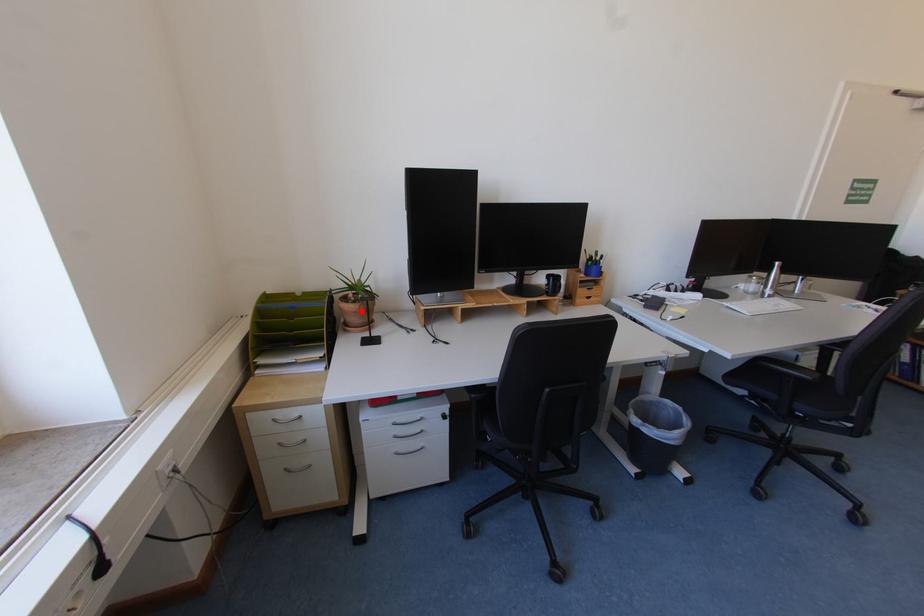
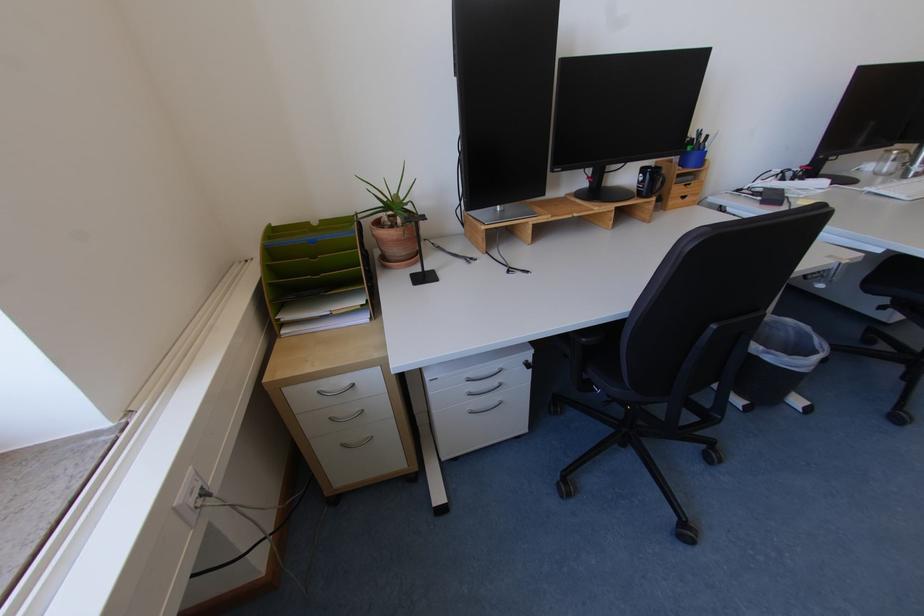
The point at the highlighted location is marked in the first image. Where is the corresponding point in the second image?

(403, 238)